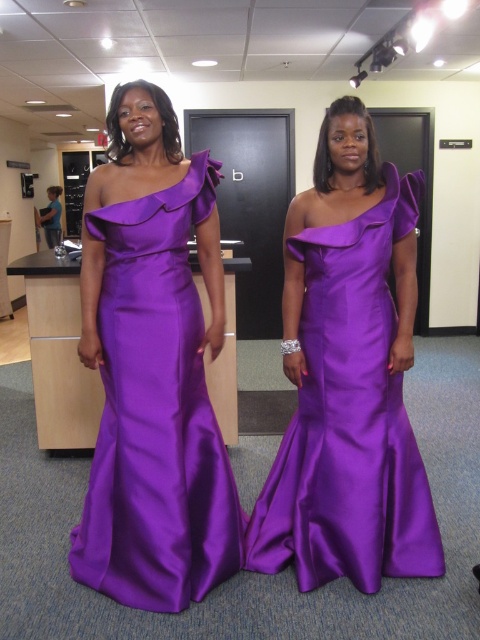
You are a fashion designer observing two women in an office setting. You notice the purple satin dress at left and the satin purple dress at center. Which dress is taller?

The purple satin dress at left is taller than the satin purple dress at center.

You are standing in an office and see two women wearing dresses. One is wearing a purple satin dress at left and the other a satin purple dress at center. Which dress is closer to you?

The purple satin dress at left is closer to you because it is in front of the satin purple dress at center.

You are a photographer standing in the office scene. You need to place a small decoration exactly at point (x=156, y=413). Which object from the scene should you be careful not to cover with the decoration?

The point (x=156, y=413) is on the purple satin dress at left, so you should be careful not to cover the purple satin dress at left with the decoration.